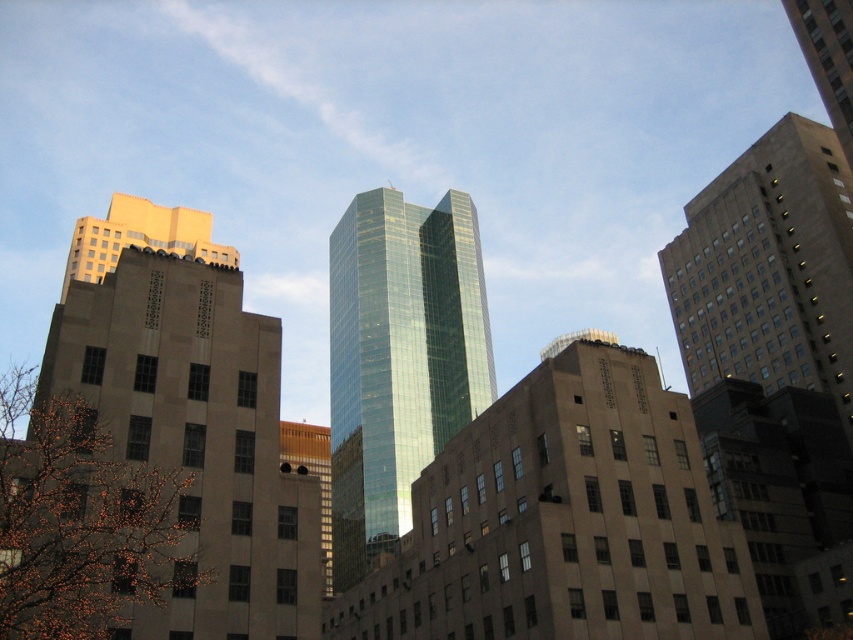
Does green glass skyscraper at center have a greater height compared to green glass skyscraper at upper center?

Yes.

Between green glass skyscraper at center and green glass skyscraper at upper center, which one is positioned lower?

green glass skyscraper at center is below.

Is point (403, 362) less distant than point (848, 74)?

No.

The width and height of the screenshot is (853, 640). I want to click on green glass skyscraper at center, so click(399, 358).

Is beige stone building at left smaller than green glass skyscraper at center?

Indeed, beige stone building at left has a smaller size compared to green glass skyscraper at center.

Locate an element on the screen. The width and height of the screenshot is (853, 640). beige stone building at left is located at coordinates pyautogui.click(x=198, y=436).

Where is `beige stone building at left`? Image resolution: width=853 pixels, height=640 pixels. beige stone building at left is located at coordinates (198, 436).

Is beige stone building at left to the left of beige concrete building at right from the viewer's perspective?

Yes, beige stone building at left is to the left of beige concrete building at right.

Can you confirm if beige stone building at left is taller than beige concrete building at right?

No, beige stone building at left is not taller than beige concrete building at right.

Where is `beige stone building at left`? The width and height of the screenshot is (853, 640). beige stone building at left is located at coordinates (198, 436).